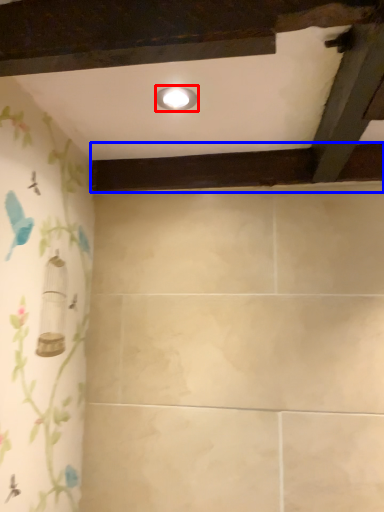
Question: Which object is closer to the camera taking this photo, light fixture (highlighted by a red box) or plank (highlighted by a blue box)?

Choices:
 (A) light fixture
 (B) plank

Answer: (A)